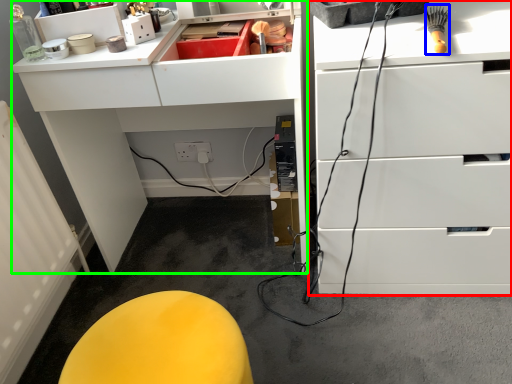
Question: Based on their relative distances, which object is nearer to chest of drawers (highlighted by a red box)? Choose from brush (highlighted by a blue box) and computer desk (highlighted by a green box).

Choices:
 (A) brush
 (B) computer desk

Answer: (A)